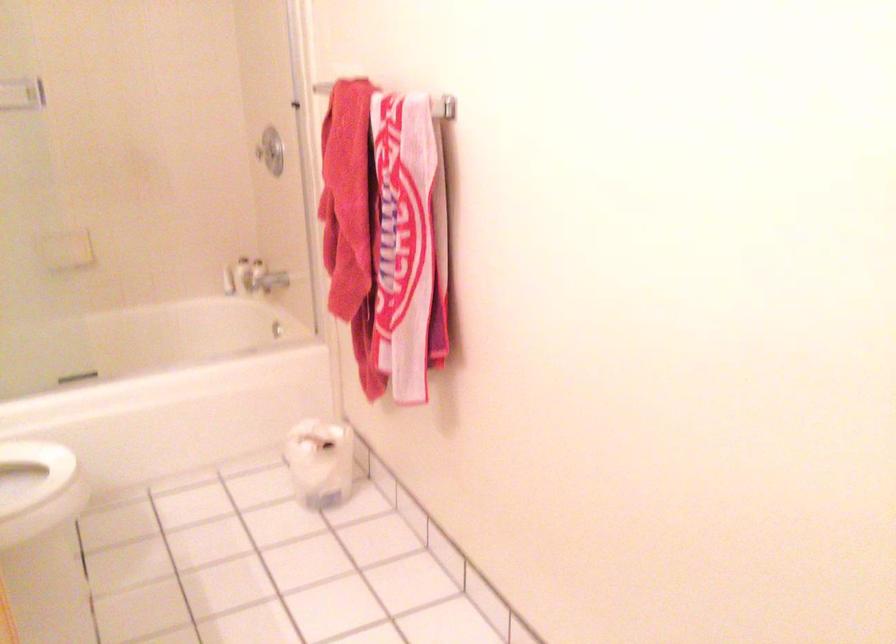
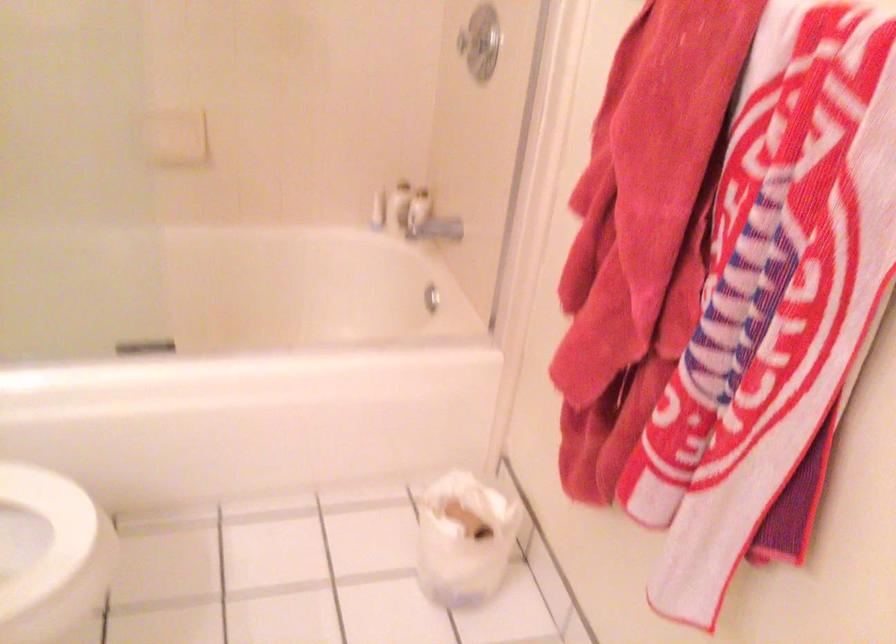
Find the pixel in the second image that matches point 316,450 in the first image.

(464, 538)